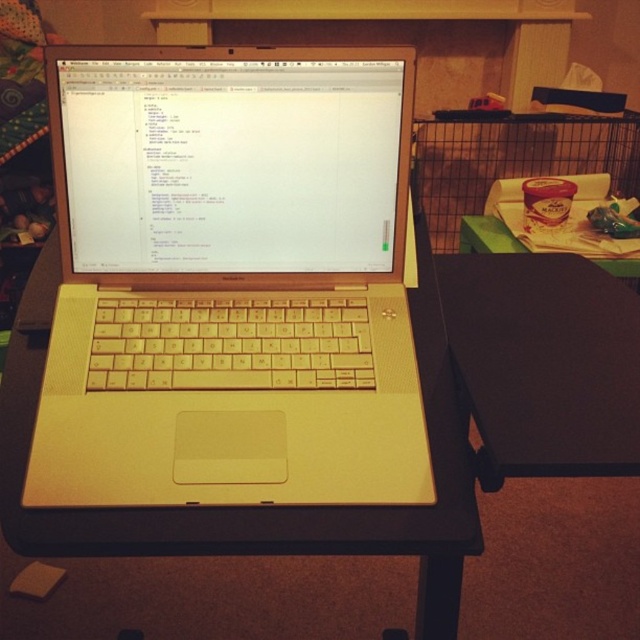
Who is positioned more to the right, black matte table at center or green matte table at right?

green matte table at right

Which is behind, point (522, 323) or point (625, 262)?

Positioned behind is point (625, 262).

At what (x,y) coordinates should I click in order to perform the action: click on black matte table at center. Please return your answer as a coordinate pair (x, y). The width and height of the screenshot is (640, 640). Looking at the image, I should click on (544, 364).

Does white matte laptop at center lie in front of black matte table at center?

That is False.

Which of these two, white matte laptop at center or black matte table at center, stands taller?

white matte laptop at center

The image size is (640, 640). In order to click on white matte laptop at center in this screenshot , I will do 228,282.

Where is `white matte laptop at center`? white matte laptop at center is located at coordinates (228, 282).

Does white matte laptop at center appear under metal wire cage at right?

Yes, white matte laptop at center is below metal wire cage at right.

The image size is (640, 640). Describe the element at coordinates (228, 282) in the screenshot. I see `white matte laptop at center` at that location.

You are a GUI agent. You are given a task and a screenshot of the screen. Output one action in this format:
    pyautogui.click(x=<x>, y=<y>)
    Task: Click on the white matte laptop at center
    
    Given the screenshot: What is the action you would take?
    pyautogui.click(x=228, y=282)